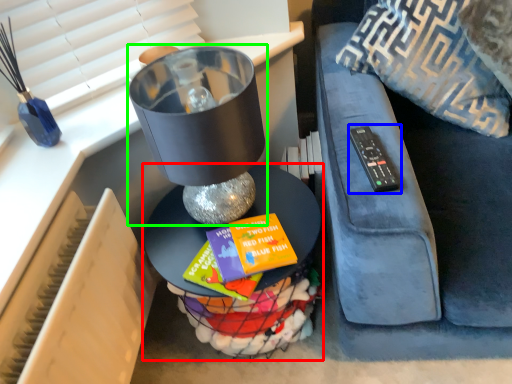
Question: Based on their relative distances, which object is nearer to table (highlighted by a red box)? Choose from remote (highlighted by a blue box) and table lamp (highlighted by a green box).

Choices:
 (A) remote
 (B) table lamp

Answer: (B)